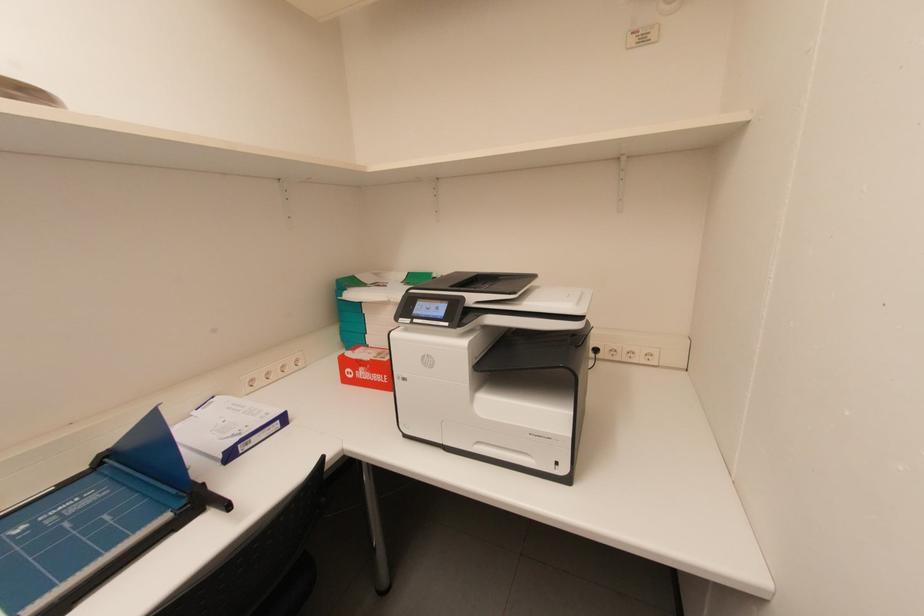
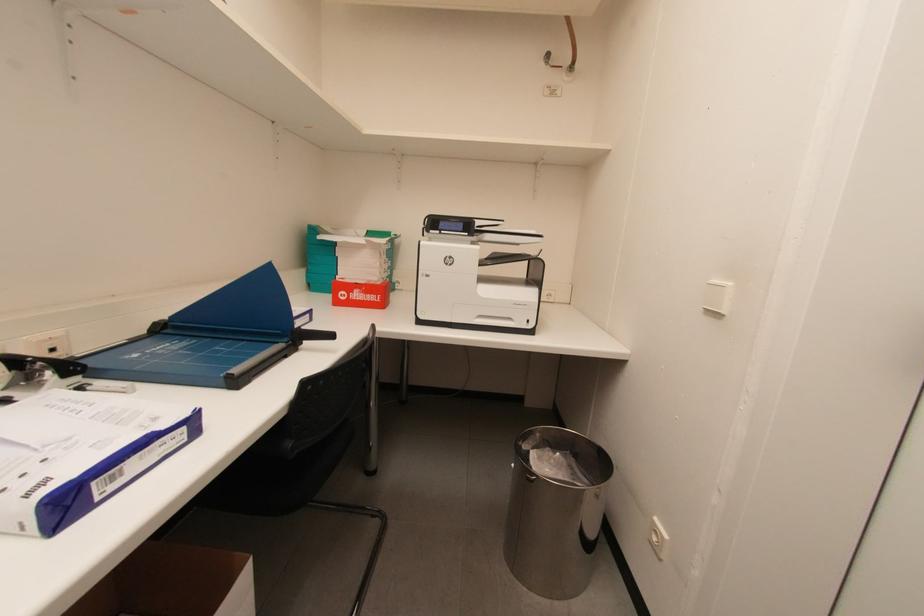
The images are taken continuously from a first-person perspective. In which direction are you moving?

The cameraman moved toward left, backward.